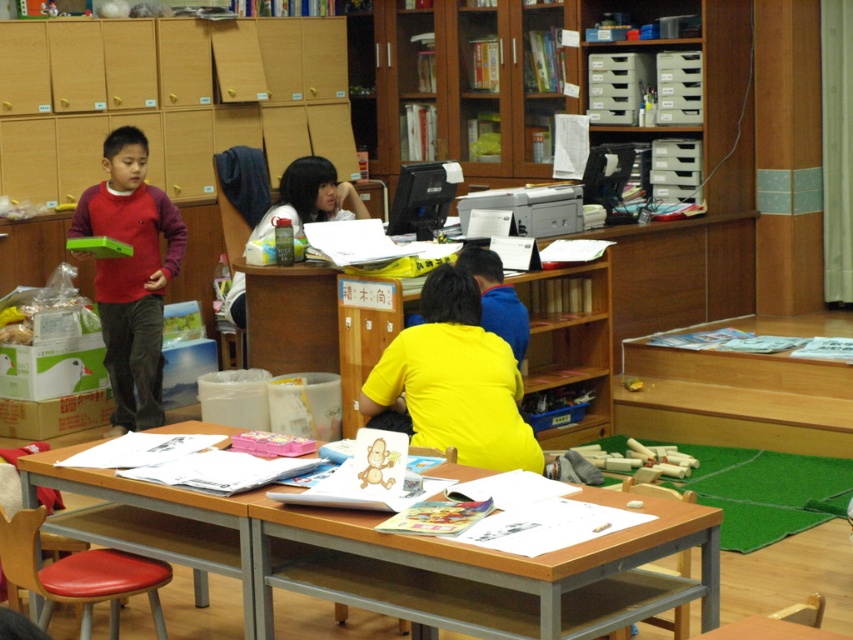
Question: Which of these objects is positioned farthest from the yellow matte shirt at center?

Choices:
 (A) matte red sweater at left
 (B) matte yellow shirt at center
 (C) wooden at center

Answer: (A)

Question: Can you confirm if wooden at center is positioned above matte red sweater at left?

Choices:
 (A) no
 (B) yes

Answer: (A)

Question: Is wooden at center wider than matte yellow shirt at center?

Choices:
 (A) no
 (B) yes

Answer: (B)

Question: Which point appears closest to the camera in this image?

Choices:
 (A) (424, 321)
 (B) (151, 243)

Answer: (A)

Question: Does wooden at center have a greater width compared to matte yellow shirt at center?

Choices:
 (A) no
 (B) yes

Answer: (B)

Question: Which object appears farthest from the camera in this image?

Choices:
 (A) matte yellow shirt at center
 (B) matte red sweater at left
 (C) yellow matte shirt at center

Answer: (B)